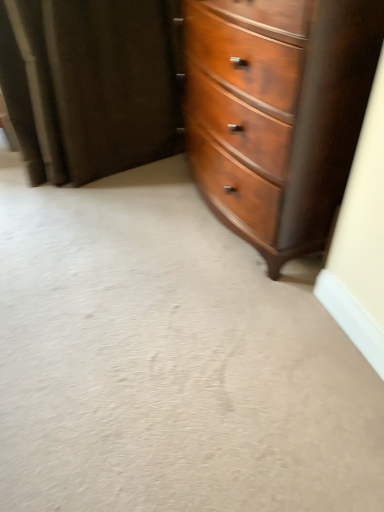
I want to click on vacant area that is in front of velvet dark brown curtain at upper left, so click(104, 230).